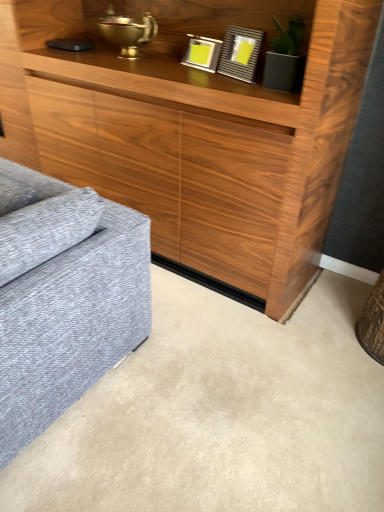
Question: Is point (208, 69) positioned closer to the camera than point (233, 57)?

Choices:
 (A) closer
 (B) farther

Answer: (B)

Question: Is metallic silver picture frame at upper center, the second picture frame in the right-to-left sequence, bigger or smaller than matte gray picture frame at upper center, the 1th picture frame viewed from the right?

Choices:
 (A) big
 (B) small

Answer: (B)

Question: From a real-world perspective, is metallic silver picture frame at upper center, the second picture frame in the right-to-left sequence, above or below matte gray picture frame at upper center, the 2th picture frame positioned from the left?

Choices:
 (A) above
 (B) below

Answer: (B)

Question: From a real-world perspective, is matte gray picture frame at upper center, the 2th picture frame positioned from the left, positioned above or below metallic silver picture frame at upper center, acting as the first picture frame starting from the left?

Choices:
 (A) above
 (B) below

Answer: (A)

Question: Looking at the image, does matte gray picture frame at upper center, the 2th picture frame positioned from the left, seem bigger or smaller compared to metallic silver picture frame at upper center, acting as the first picture frame starting from the left?

Choices:
 (A) big
 (B) small

Answer: (A)

Question: Visually, is matte gray picture frame at upper center, the 1th picture frame viewed from the right, positioned to the left or to the right of metallic silver picture frame at upper center, acting as the first picture frame starting from the left?

Choices:
 (A) left
 (B) right

Answer: (B)

Question: Is matte gray picture frame at upper center, the 2th picture frame positioned from the left, situated inside metallic silver picture frame at upper center, acting as the first picture frame starting from the left, or outside?

Choices:
 (A) inside
 (B) outside

Answer: (B)